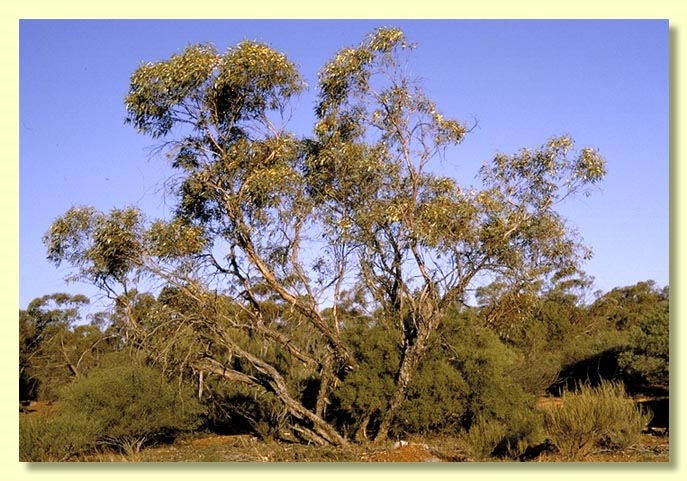
I want to click on rectangular photo longer vertically, so click(633, 192).